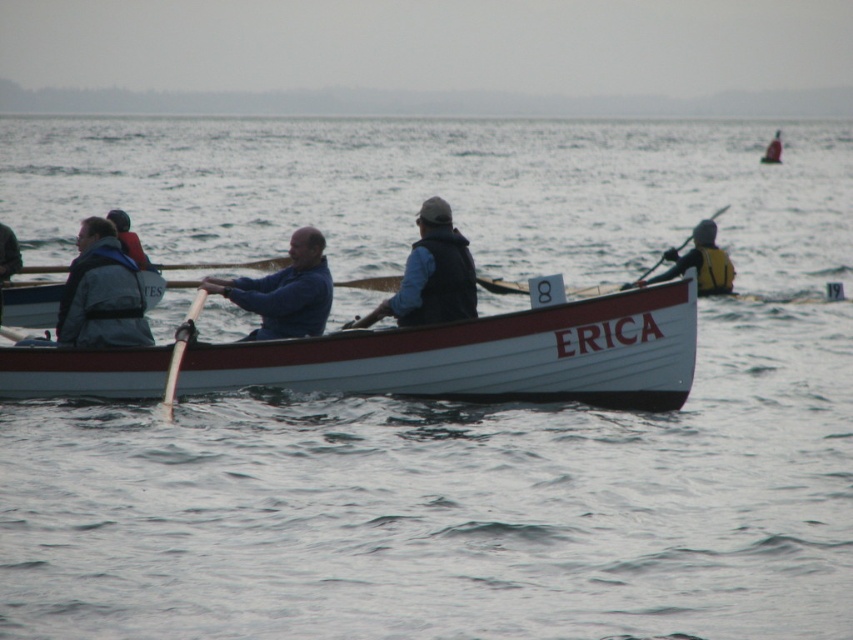
You are a photographer positioned at the starting line of the race. You want to take a photo of the boat named ERICA so that both the point at coordinate [132,278] and the point at coordinate [117,221] are visible in the frame. Based on their positions, which point should be closer to the front of the photo?

Point at coordinate [132,278] is in front of point at coordinate [117,221], so it should be closer to the front of the photo.

You are a safety inspector checking the equipment in the rowing boat named ERICA. You notice the matte gray life vest at left and the white wood paddle at center. Which item is shorter in height?

The matte gray life vest at left is shorter than the white wood paddle at center.

You are a safety inspector checking the boat ERICA. You notice two items on the left side of the boat. Which item is positioned lower down between the matte blue life vest at left and the blue fabric jacket at left?

The matte blue life vest at left is located below the blue fabric jacket at left, so it is positioned lower down.